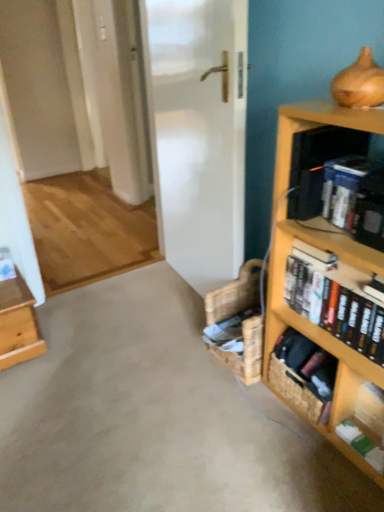
Question: Can you confirm if woven brown basket at lower right is shorter than light brown wooden table at left?

Choices:
 (A) yes
 (B) no

Answer: (A)

Question: Would you consider woven brown basket at lower right to be distant from light brown wooden table at left?

Choices:
 (A) no
 (B) yes

Answer: (B)

Question: From a real-world perspective, is woven brown basket at lower right under light brown wooden table at left?

Choices:
 (A) no
 (B) yes

Answer: (B)

Question: Is woven brown basket at lower right to the right of light brown wooden table at left from the viewer's perspective?

Choices:
 (A) yes
 (B) no

Answer: (A)

Question: Is woven brown basket at lower right located outside light brown wooden table at left?

Choices:
 (A) yes
 (B) no

Answer: (A)

Question: From a real-world perspective, does woven brown basket at lower right stand above light brown wooden table at left?

Choices:
 (A) no
 (B) yes

Answer: (A)

Question: Can you confirm if green matte book at lower right, placed as the third book when sorted from top to bottom, is positioned to the left of wooden bookcase at right?

Choices:
 (A) yes
 (B) no

Answer: (B)

Question: From a real-world perspective, is green matte book at lower right, placed as the third book when sorted from top to bottom, located higher than wooden bookcase at right?

Choices:
 (A) yes
 (B) no

Answer: (B)

Question: Is green matte book at lower right, which is the 1th book in bottom-to-top order, positioned beyond the bounds of wooden bookcase at right?

Choices:
 (A) yes
 (B) no

Answer: (B)

Question: Can you confirm if green matte book at lower right, placed as the third book when sorted from top to bottom, is thinner than wooden bookcase at right?

Choices:
 (A) no
 (B) yes

Answer: (B)

Question: Is green matte book at lower right, which is the 1th book in bottom-to-top order, at the right side of wooden bookcase at right?

Choices:
 (A) no
 (B) yes

Answer: (B)

Question: Is green matte book at lower right, which is the 1th book in bottom-to-top order, not near wooden bookcase at right?

Choices:
 (A) no
 (B) yes

Answer: (A)

Question: Does hardcover books at right, the 2th book from the bottom, appear on the right side of blue hardcover book at upper right, which ranks as the first book in top-to-bottom order?

Choices:
 (A) yes
 (B) no

Answer: (A)